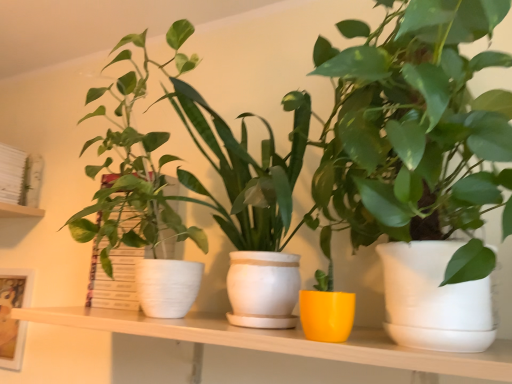
Question: Considering the relative sizes of matte white pot at center, placed as the third houseplant when sorted from left to right, and matte white picture frame at left in the image provided, is matte white pot at center, placed as the third houseplant when sorted from left to right, wider than matte white picture frame at left?

Choices:
 (A) yes
 (B) no

Answer: (A)

Question: Is there a large distance between matte white pot at center, which is the first houseplant from right to left, and matte white picture frame at left?

Choices:
 (A) no
 (B) yes

Answer: (B)

Question: Can you confirm if matte white pot at center, which is the first houseplant from right to left, is bigger than matte white picture frame at left?

Choices:
 (A) no
 (B) yes

Answer: (B)

Question: Can you confirm if matte white pot at center, which is the first houseplant from right to left, is shorter than matte white picture frame at left?

Choices:
 (A) yes
 (B) no

Answer: (B)

Question: From a real-world perspective, is matte white pot at center, which is the first houseplant from right to left, positioned under matte white picture frame at left based on gravity?

Choices:
 (A) yes
 (B) no

Answer: (B)

Question: Is white matte bookshelf at upper left inside the boundaries of matte white pot at left, the first houseplant in the left-to-right sequence, or outside?

Choices:
 (A) outside
 (B) inside

Answer: (A)

Question: From their relative heights in the image, would you say white matte bookshelf at upper left is taller or shorter than matte white pot at left, which is the 3th houseplant in right-to-left order?

Choices:
 (A) tall
 (B) short

Answer: (B)

Question: Visually, is white matte bookshelf at upper left positioned to the left or to the right of matte white pot at left, the first houseplant in the left-to-right sequence?

Choices:
 (A) left
 (B) right

Answer: (A)

Question: From a real-world perspective, is white matte bookshelf at upper left physically located above or below matte white pot at left, the first houseplant in the left-to-right sequence?

Choices:
 (A) above
 (B) below

Answer: (A)

Question: Is matte white pot at center, which is the first houseplant from right to left, bigger or smaller than matte white shelf at center?

Choices:
 (A) small
 (B) big

Answer: (B)

Question: Is matte white pot at center, which is the first houseplant from right to left, taller or shorter than matte white shelf at center?

Choices:
 (A) tall
 (B) short

Answer: (A)

Question: From the image's perspective, is matte white pot at center, placed as the third houseplant when sorted from left to right, positioned above or below matte white shelf at center?

Choices:
 (A) below
 (B) above

Answer: (B)

Question: In the image, is matte white pot at center, placed as the third houseplant when sorted from left to right, on the left side or the right side of matte white shelf at center?

Choices:
 (A) left
 (B) right

Answer: (B)

Question: From the image's perspective, relative to matte white picture frame at left, is matte white pot at left, which is the 3th houseplant in right-to-left order, above or below?

Choices:
 (A) above
 (B) below

Answer: (A)

Question: Is matte white pot at left, which is the 3th houseplant in right-to-left order, to the left or to the right of matte white picture frame at left in the image?

Choices:
 (A) right
 (B) left

Answer: (A)